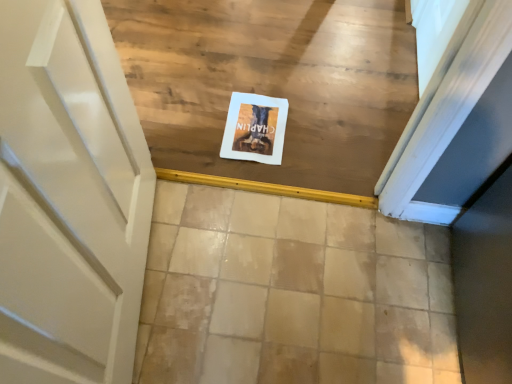
Question: Considering the relative positions of beige tile at center and white paper at center in the image provided, is beige tile at center to the left of white paper at center from the viewer's perspective?

Choices:
 (A) no
 (B) yes

Answer: (A)

Question: Is beige tile at center taller than white paper at center?

Choices:
 (A) no
 (B) yes

Answer: (B)

Question: Does beige tile at center touch white paper at center?

Choices:
 (A) yes
 (B) no

Answer: (B)

Question: Does beige tile at center have a larger size compared to white paper at center?

Choices:
 (A) yes
 (B) no

Answer: (A)

Question: Can you confirm if beige tile at center is wider than white paper at center?

Choices:
 (A) yes
 (B) no

Answer: (A)

Question: From the image's perspective, is beige tile at center below white paper at center?

Choices:
 (A) no
 (B) yes

Answer: (B)

Question: Does white paper at center have a greater height compared to beige tile at center?

Choices:
 (A) yes
 (B) no

Answer: (B)

Question: Is white paper at center far away from beige tile at center?

Choices:
 (A) yes
 (B) no

Answer: (B)

Question: Is the position of white paper at center more distant than that of beige tile at center?

Choices:
 (A) no
 (B) yes

Answer: (B)

Question: From the image's perspective, is white paper at center above beige tile at center?

Choices:
 (A) no
 (B) yes

Answer: (B)

Question: Is white paper at center bigger than beige tile at center?

Choices:
 (A) no
 (B) yes

Answer: (A)

Question: From a real-world perspective, is white paper at center below beige tile at center?

Choices:
 (A) yes
 (B) no

Answer: (B)

Question: Considering their positions, is white paper at center located in front of or behind beige tile at center?

Choices:
 (A) front
 (B) behind

Answer: (B)